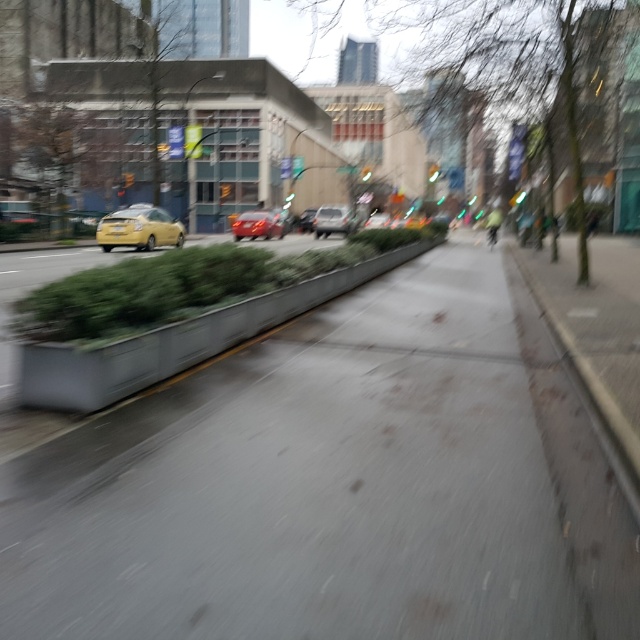
You are a delivery person standing at the camera position. You need to deliver a package to the green leafy tree at center. The package requires placing it within 10 meters of the tree. Can you do it from your current position?

The green leafy tree at center is 14.85 meters from camera, so you cannot place the package within 10 meters as the distance is greater than required.

You are a delivery person trying to navigate through the street. You see the concrete at center and the shiny red car at center. Which object is closer to the ground?

The concrete at center is closer to the ground because it is shorter than the shiny red car at center.

You are a pedestrian standing on the sidewalk and want to cross the street. You see the green leafy tree at center and the metallic silver sedan at center. Which object is closer to you?

The green leafy tree at center is closer to the viewer than the metallic silver sedan at center.